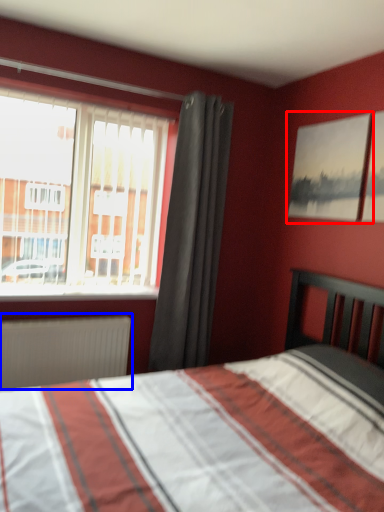
Question: Which object is closer to the camera taking this photo, picture frame (highlighted by a red box) or radiator (highlighted by a blue box)?

Choices:
 (A) picture frame
 (B) radiator

Answer: (A)